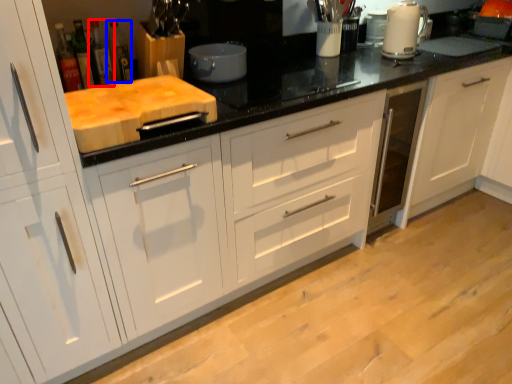
Question: Which point is further to the camera, bottle (highlighted by a red box) or bottle (highlighted by a blue box)?

Choices:
 (A) bottle
 (B) bottle

Answer: (B)